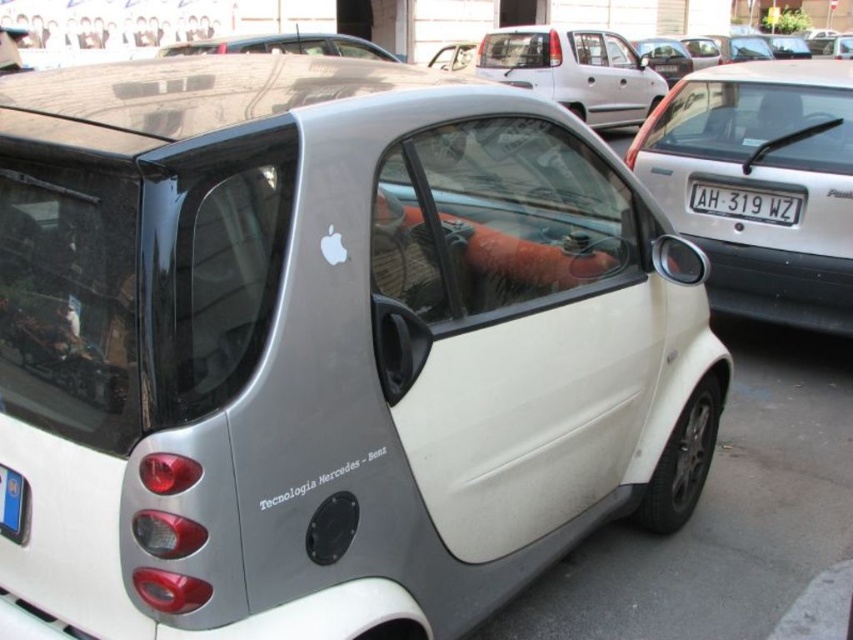
Question: Estimate the real-world distances between objects in this image. Which object is farther from the silver metallic car at upper center?

Choices:
 (A) white matte car at center
 (B) white plastic license plate at center
 (C) silver metallic car at center

Answer: (B)

Question: Which of the following is the closest to the observer?

Choices:
 (A) (844, 278)
 (B) (585, 109)

Answer: (A)

Question: Is silver metallic car at center thinner than silver metallic car at upper center?

Choices:
 (A) no
 (B) yes

Answer: (A)

Question: Is the position of white matte car at center less distant than that of white plastic license plate at center?

Choices:
 (A) no
 (B) yes

Answer: (A)

Question: Which point appears closest to the camera in this image?

Choices:
 (A) (321, 33)
 (B) (654, 100)
 (C) (744, 198)
 (D) (671, 196)

Answer: (C)

Question: Considering the relative positions of silver metallic car at center and white plastic license plate at center in the image provided, where is silver metallic car at center located with respect to white plastic license plate at center?

Choices:
 (A) above
 (B) below

Answer: (A)